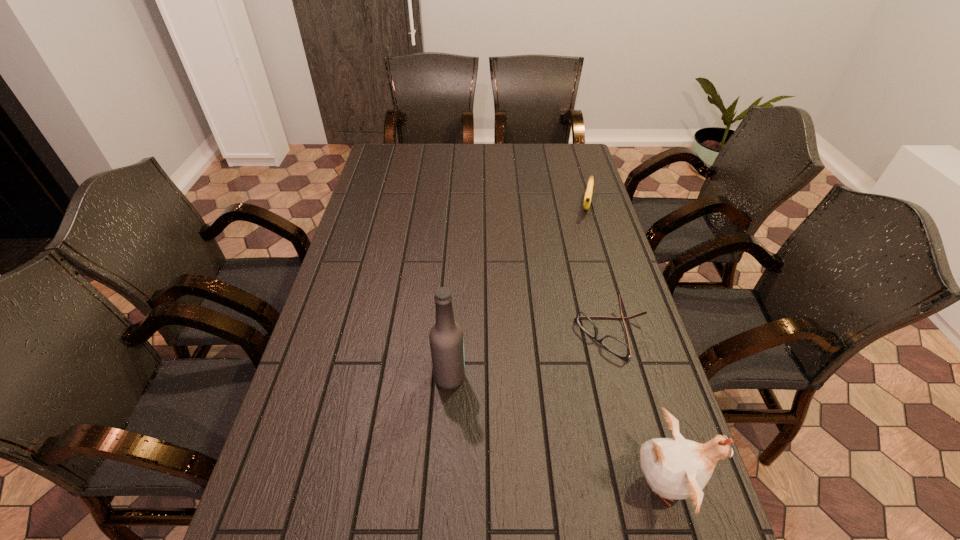
The image size is (960, 540). What are the coordinates of `vacant area that lies between the third tallest object and the shortest object` in the screenshot? It's located at (599, 269).

The height and width of the screenshot is (540, 960). In order to click on blank region between the banana and the third nearest object in this screenshot , I will do `click(599, 269)`.

The height and width of the screenshot is (540, 960). Identify the location of unoccupied position between the shortest object and the farthest object. (599, 269).

Identify which object is the second closest to the banana. Please provide its 2D coordinates. Your answer should be formatted as a tuple, i.e. [(x, y)], where the tuple contains the x and y coordinates of a point satisfying the conditions above.

[(446, 338)]

You are a GUI agent. You are given a task and a screenshot of the screen. Output one action in this format:
    pyautogui.click(x=<x>, y=<y>)
    Task: Click on the object that is the third nearest to the beer bottle
    
    Given the screenshot: What is the action you would take?
    pyautogui.click(x=588, y=194)